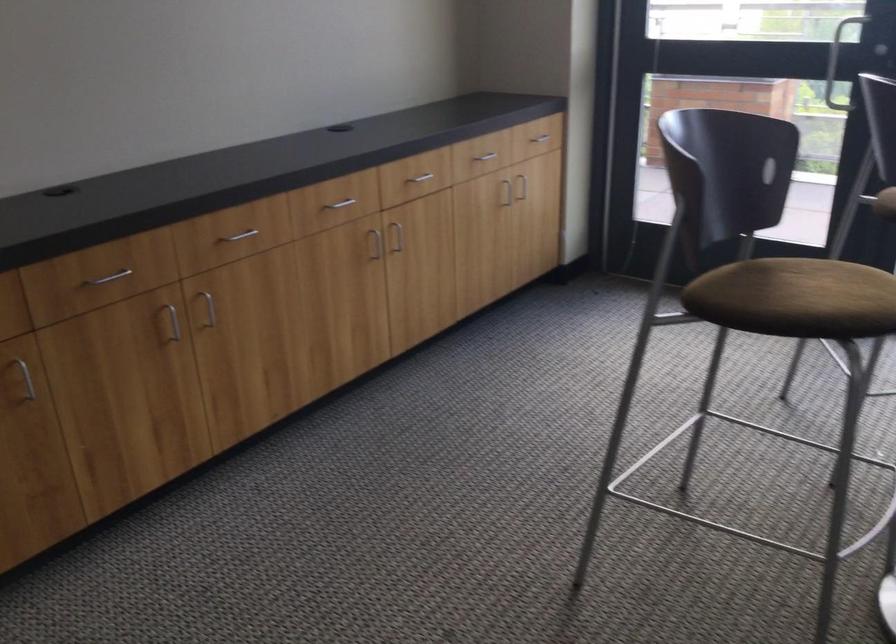
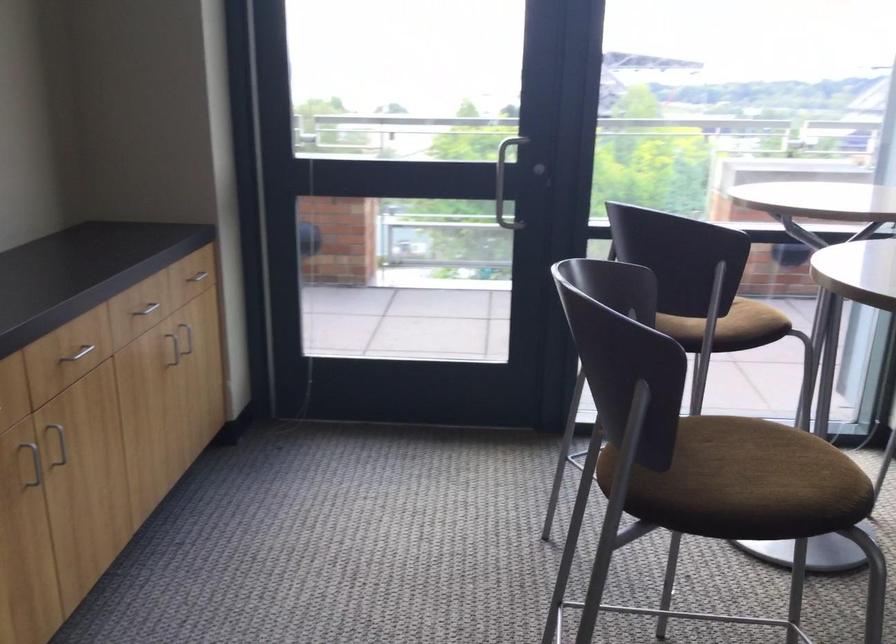
Where in the second image is the point corresponding to (x=412, y=172) from the first image?

(80, 353)